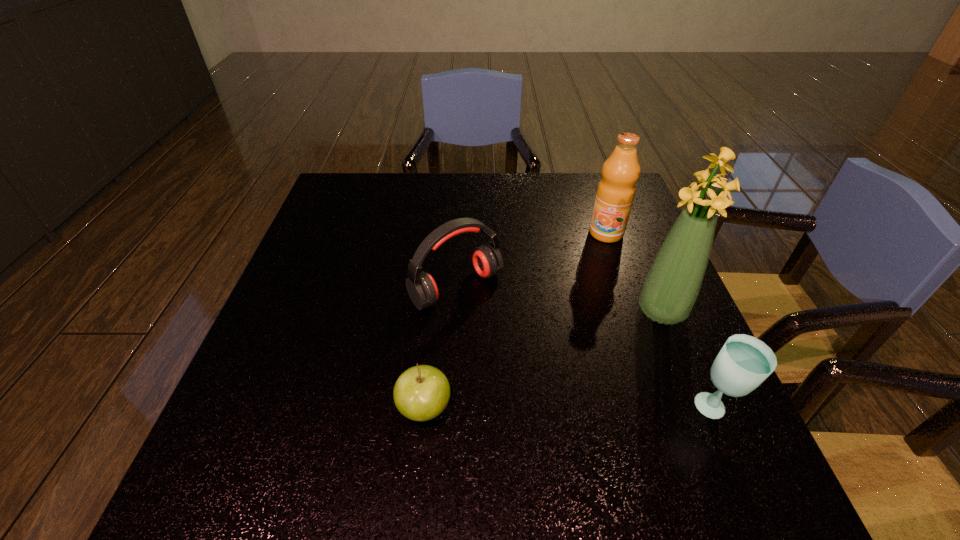
Where is `free space on the desktop that is between the apple and the glass and is positioned on the front label of the farthest object`? The image size is (960, 540). free space on the desktop that is between the apple and the glass and is positioned on the front label of the farthest object is located at coordinates (537, 408).

You are a GUI agent. You are given a task and a screenshot of the screen. Output one action in this format:
    pyautogui.click(x=<x>, y=<y>)
    Task: Click on the free space on the desktop that is between the shortest object and the glass and is positioned on the front-facing side of the tallest object
    This screenshot has height=540, width=960.
    Given the screenshot: What is the action you would take?
    pyautogui.click(x=542, y=408)

I want to click on free space on the desktop that is between the shortest object and the glass and is positioned on the ear cups of the earphone, so click(x=569, y=408).